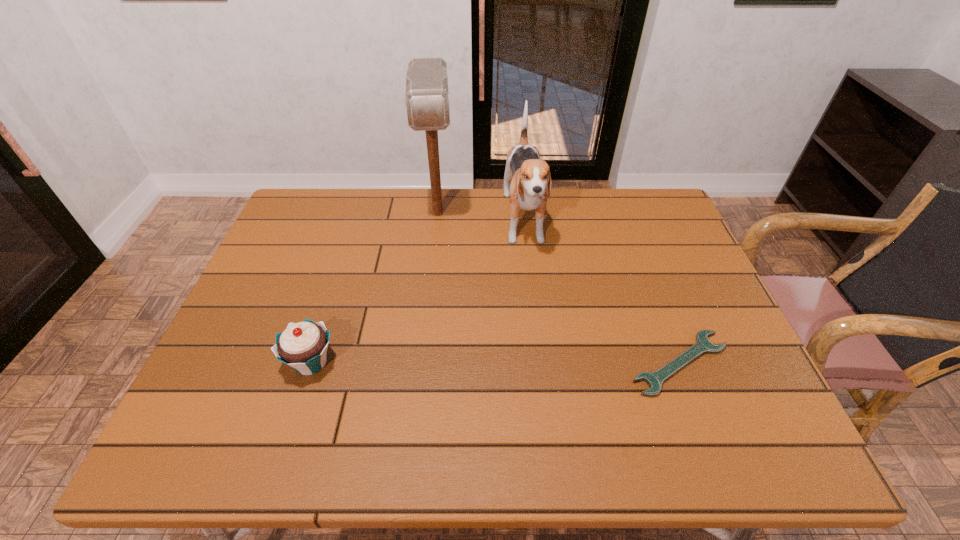
Where is `vacant space that satisfies the following two spatial constraints: 1. on the back side of the tallest object; 2. on the left side of the leftmost object`? vacant space that satisfies the following two spatial constraints: 1. on the back side of the tallest object; 2. on the left side of the leftmost object is located at coordinates (359, 213).